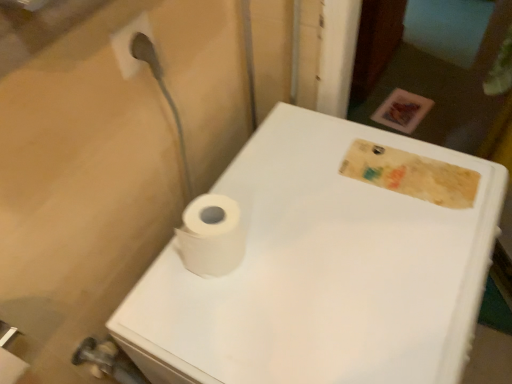
You are a GUI agent. You are given a task and a screenshot of the screen. Output one action in this format:
    pyautogui.click(x=<x>, y=<y>)
    Task: Click on the blank space situated above white matte porcelain at center (from a real-world perspective)
    Image resolution: width=512 pixels, height=384 pixels.
    Given the screenshot: What is the action you would take?
    pyautogui.click(x=339, y=246)